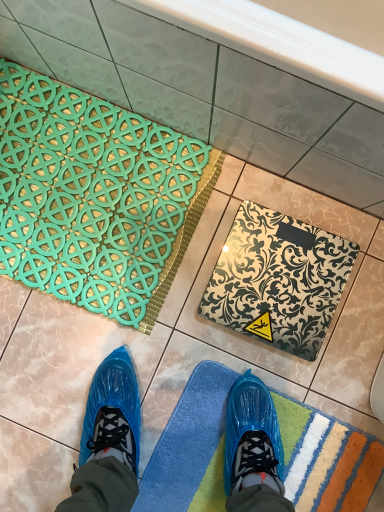
Find the location of `vacant point above teal rubber bath mat at upper left, the 1th bath mat from the top (from a real-world perspective)`. vacant point above teal rubber bath mat at upper left, the 1th bath mat from the top (from a real-world perspective) is located at coordinates (86, 203).